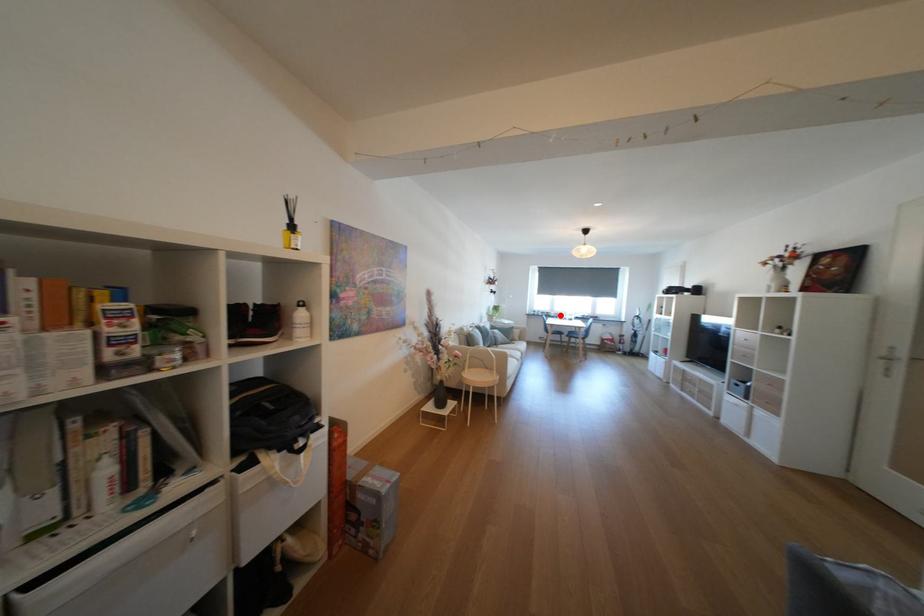
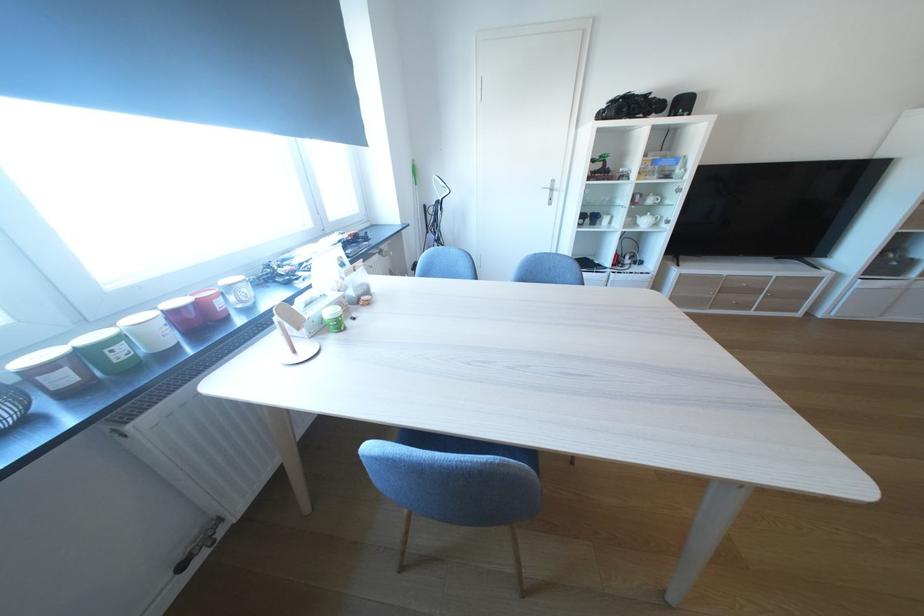
Where in the second image is the point corresponding to the highlighted location from the first image?

(129, 354)